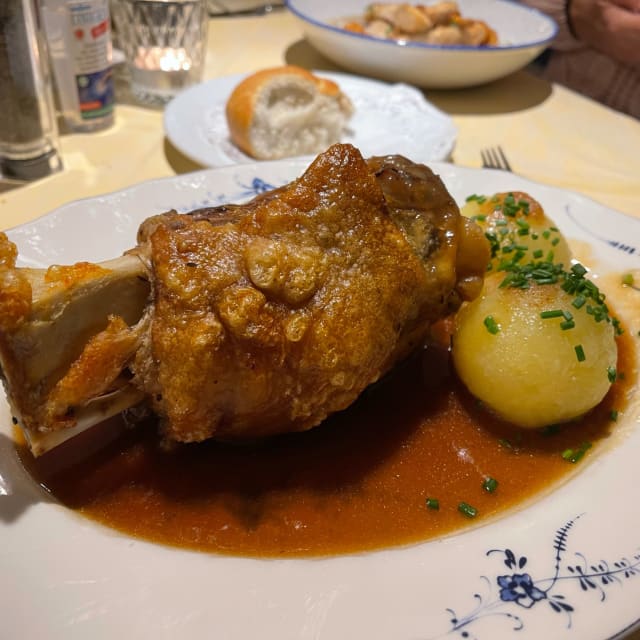
Identify the location of white plate. The height and width of the screenshot is (640, 640). (481, 569), (316, 585), (91, 557), (77, 563), (160, 595), (173, 604), (81, 212), (171, 192), (585, 211).